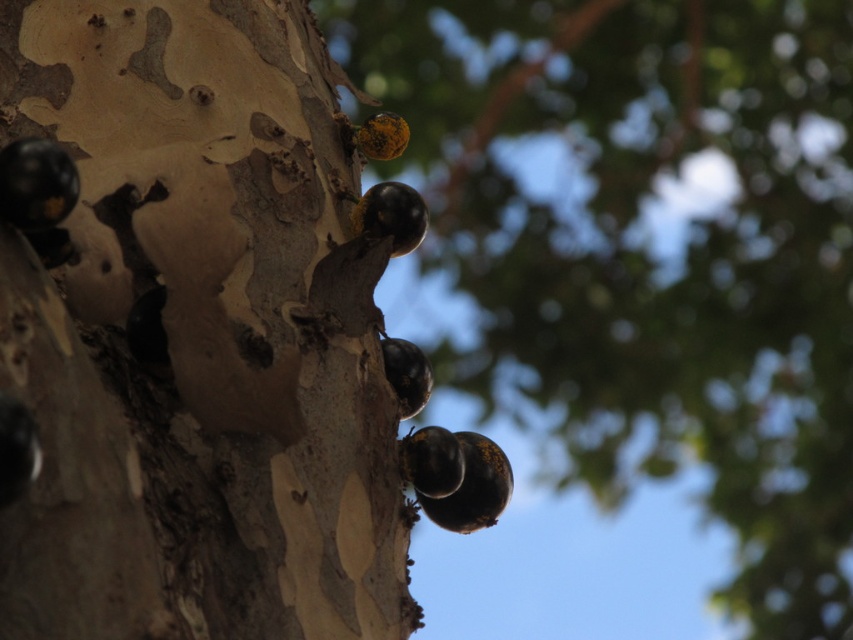
You are an artist sketching the tree trunk and berries. You want to draw the matte bark tree trunk at upper left and the shiny black berries at upper center. Which object should you draw first if you start from the bottom of the page and move upwards?

The matte bark tree trunk at upper left should be drawn first because it is positioned under the shiny black berries at upper center, so starting from the bottom and moving upwards, you would draw the lower object first.

You are a photographer adjusting your camera focus. You notice two points of interest on the tree trunk labeled as point (x=378, y=536) and point (x=553, y=384). Which point should you focus on if you want to capture the closest object to the camera?

Point (x=378, y=536) is closer to the camera than point (x=553, y=384), so you should focus on point (x=378, y=536) to capture the closest object.

Where is the matte bark tree trunk at upper left located in the image?

The matte bark tree trunk at upper left is located at point (196, 337).